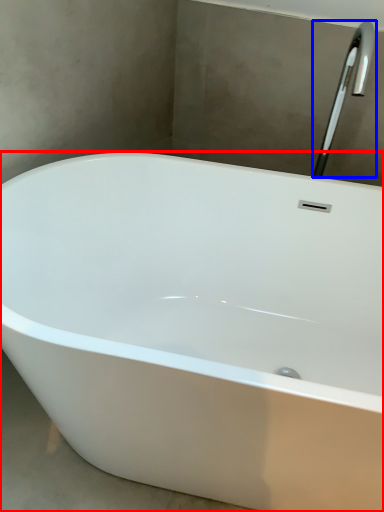
Question: Which object is closer to the camera taking this photo, bathtub (highlighted by a red box) or tap (highlighted by a blue box)?

Choices:
 (A) bathtub
 (B) tap

Answer: (A)